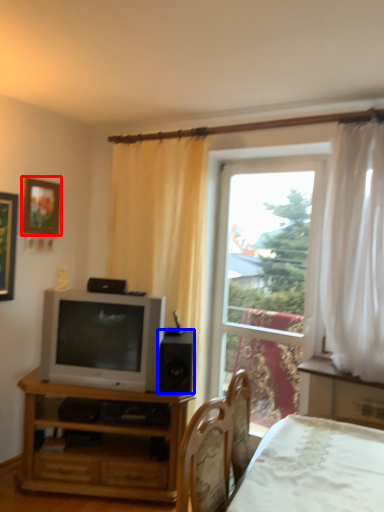
Question: Among these objects, which one is farthest to the camera, picture frame (highlighted by a red box) or speaker (highlighted by a blue box)?

Choices:
 (A) picture frame
 (B) speaker

Answer: (A)